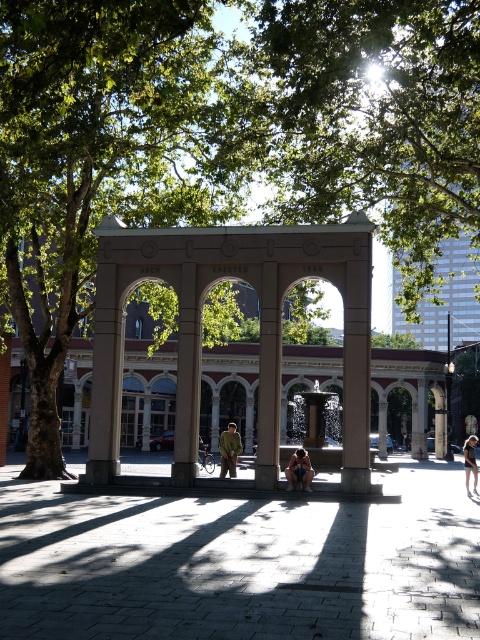
Can you confirm if smooth stone column at center is bigger than matte brown person at center?

Actually, smooth stone column at center might be smaller than matte brown person at center.

Does smooth stone column at center appear over matte brown person at center?

Yes, smooth stone column at center is above matte brown person at center.

The image size is (480, 640). Identify the location of smooth stone column at center. (268, 380).

Find the location of `smooth stone column at center`. smooth stone column at center is located at coordinates (268, 380).

Consider the image. Does concrete bench at center have a greater width compared to matte brown person at center?

Yes.

Does concrete bench at center have a larger size compared to matte brown person at center?

Correct, concrete bench at center is larger in size than matte brown person at center.

Identify the location of concrete bench at center. (241, 563).

Can you confirm if matte stone column at center is positioned to the right of dark hair at center?

Incorrect, matte stone column at center is not on the right side of dark hair at center.

Who is higher up, matte stone column at center or dark hair at center?

matte stone column at center

Is point (183, 470) positioned behind point (465, 456)?

No, (183, 470) is closer to viewer.

The image size is (480, 640). I want to click on matte stone column at center, so click(x=187, y=380).